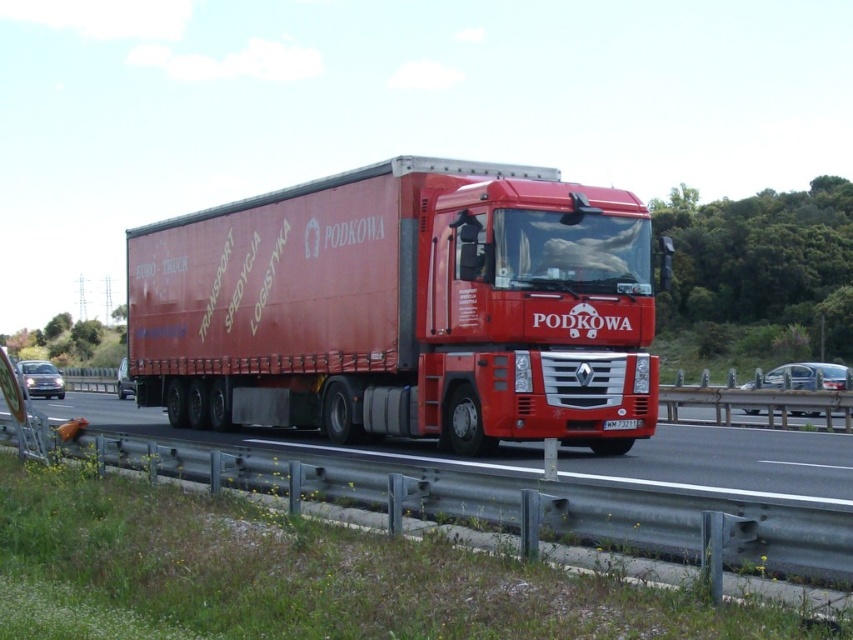
Question: Does metallic highway at lower left appear under white plastic license plate at center?

Choices:
 (A) no
 (B) yes

Answer: (B)

Question: Is matte red trailer truck at center below metallic highway at lower left?

Choices:
 (A) yes
 (B) no

Answer: (B)

Question: Which of the following is the farthest from the observer?

Choices:
 (A) (312, 230)
 (B) (579, 472)
 (C) (618, 426)

Answer: (A)

Question: Which of the following is the closest to the observer?

Choices:
 (A) white plastic license plate at center
 (B) matte red trailer truck at center

Answer: (B)

Question: Is matte red trailer truck at center above white plastic license plate at center?

Choices:
 (A) yes
 (B) no

Answer: (A)

Question: Estimate the real-world distances between objects in this image. Which object is closer to the metallic highway at lower left?

Choices:
 (A) white plastic license plate at center
 (B) matte red trailer truck at center

Answer: (B)